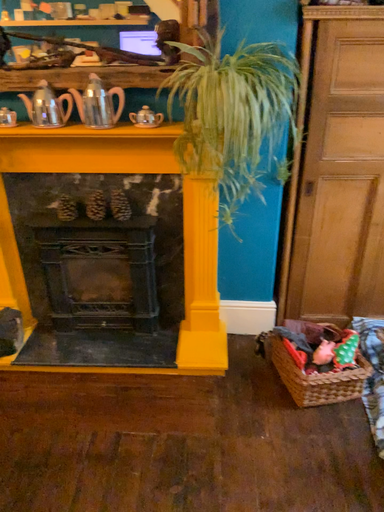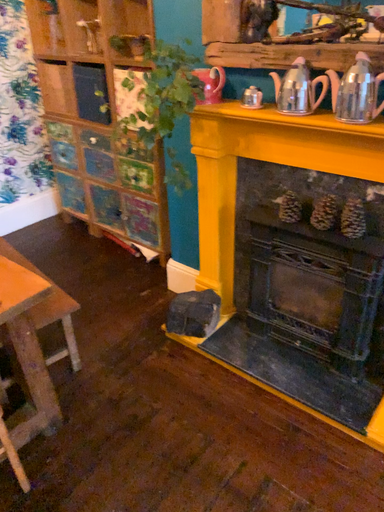
Question: How did the camera likely rotate when shooting the video?

Choices:
 (A) rotated right
 (B) rotated left

Answer: (B)